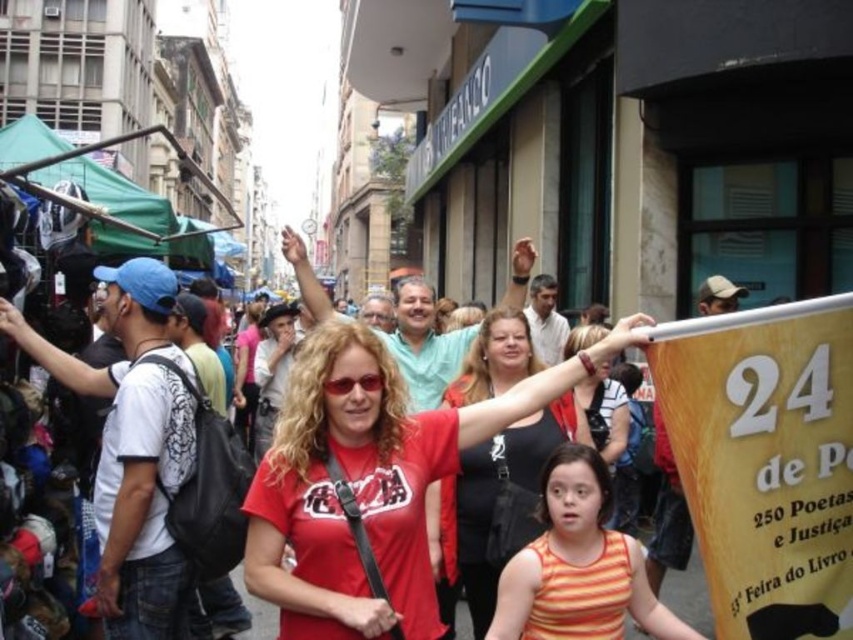
Question: Can you confirm if matte red t-shirt at center is thinner than matte red shirt at center?

Choices:
 (A) yes
 (B) no

Answer: (B)

Question: Which of the following is the farthest from the observer?

Choices:
 (A) orange striped tank top at center
 (B) matte red t-shirt at center

Answer: (A)

Question: Which point is farther from the camera taking this photo?

Choices:
 (A) (589, 600)
 (B) (570, 410)

Answer: (B)

Question: Is matte red t-shirt at center behind matte red shirt at center?

Choices:
 (A) yes
 (B) no

Answer: (B)

Question: Which point appears farthest from the camera in this image?

Choices:
 (A) (515, 525)
 (B) (502, 605)
 (C) (399, 497)

Answer: (A)

Question: Is matte red t-shirt at center to the left of orange striped tank top at center from the viewer's perspective?

Choices:
 (A) yes
 (B) no

Answer: (A)